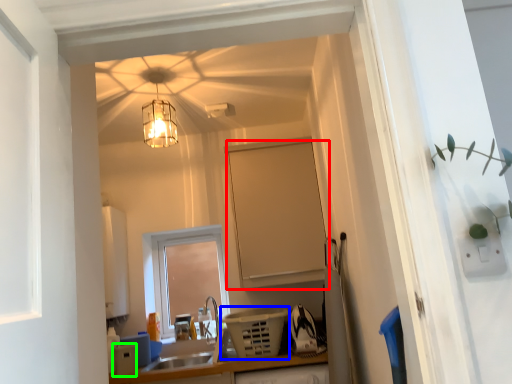
Question: Considering the real-world distances, which object is closest to cabinetry (highlighted by a red box)? appliance (highlighted by a blue box) or appliance (highlighted by a green box).

Choices:
 (A) appliance
 (B) appliance

Answer: (A)